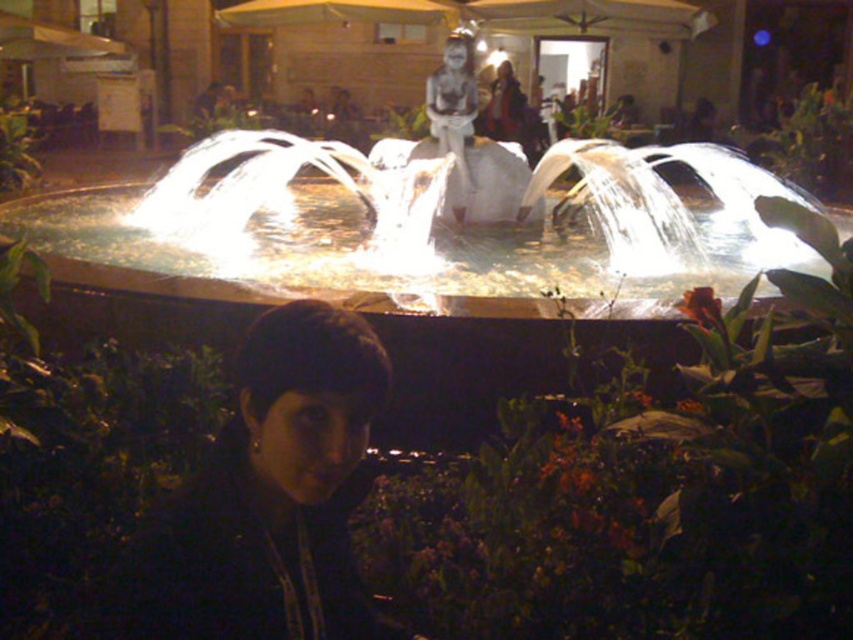
Can you confirm if illuminated stone fountain at center is smaller than dark matte hair at lower center?

Actually, illuminated stone fountain at center might be larger than dark matte hair at lower center.

Measure the distance from illuminated stone fountain at center to dark matte hair at lower center.

3.93 meters

Where is `illuminated stone fountain at center`? This screenshot has width=853, height=640. illuminated stone fountain at center is located at coordinates (415, 228).